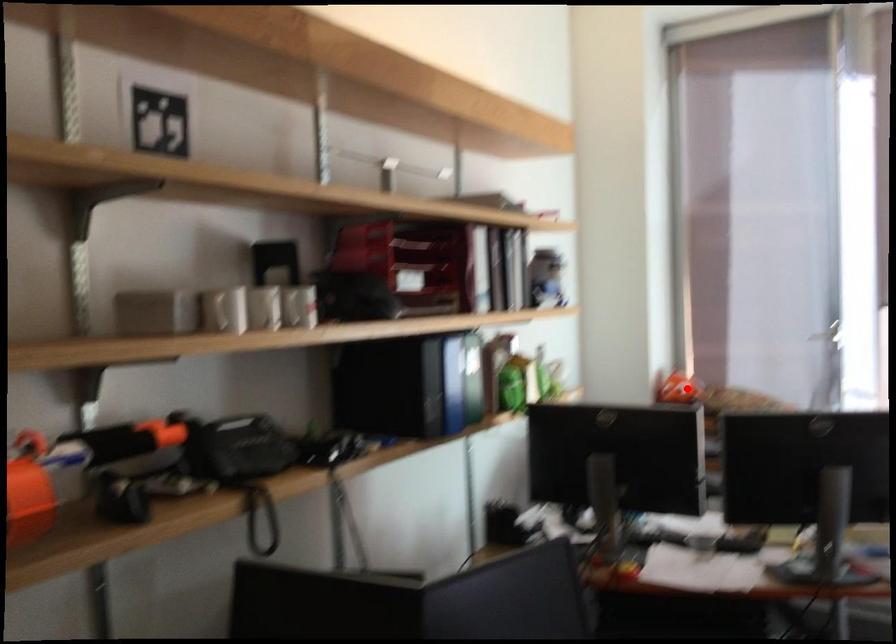
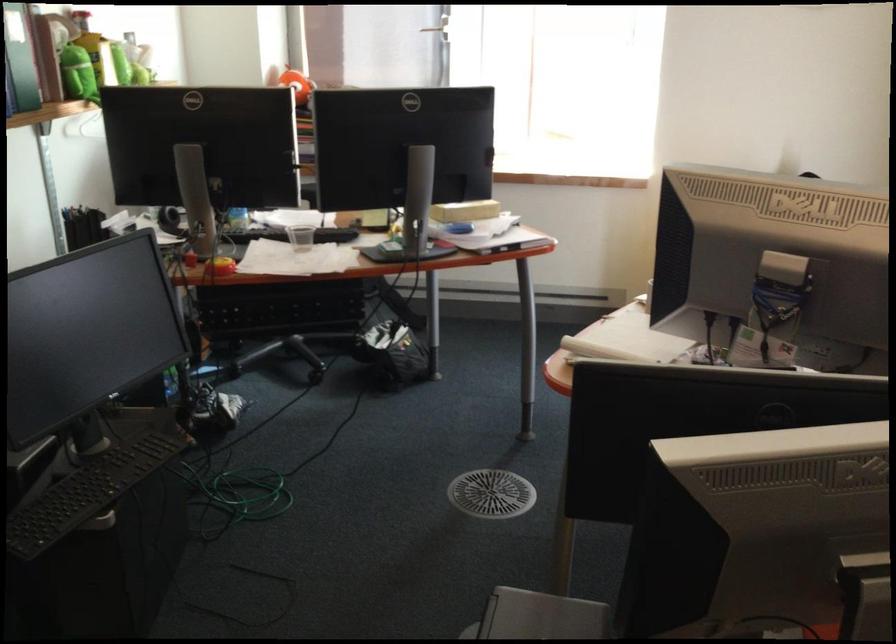
Where in the second image is the point corresponding to the highlighted location from the first image?

(297, 84)